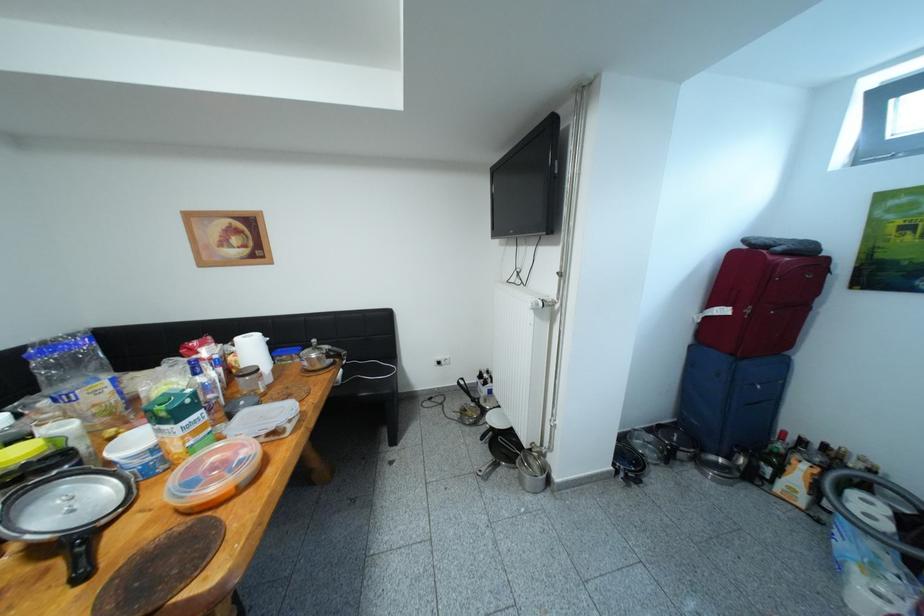
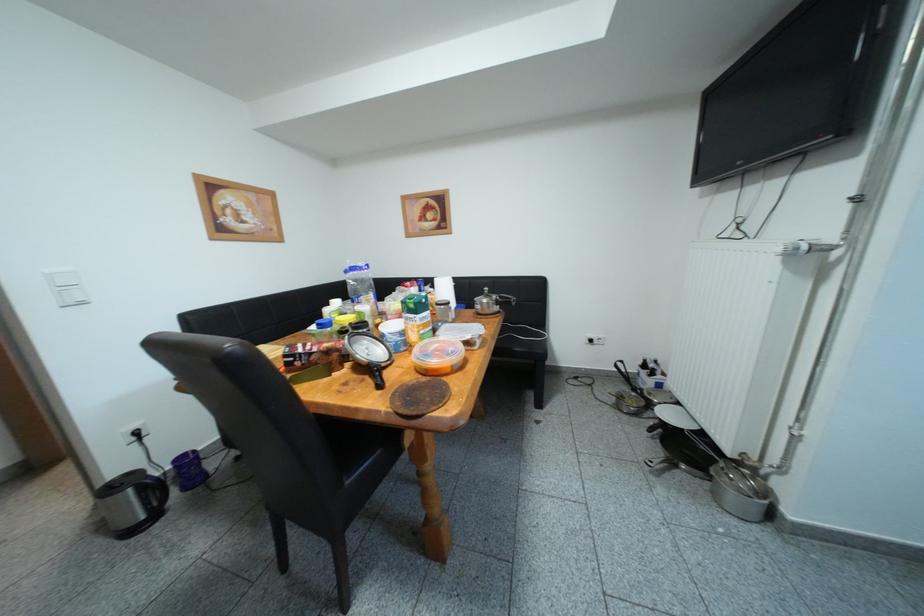
Question: The camera is either moving clockwise (left) or counter-clockwise (right) around the object. The first image is from the beginning of the video and the second image is from the end. Is the camera moving left or right when shooting the video?

Choices:
 (A) Left
 (B) Right

Answer: (B)